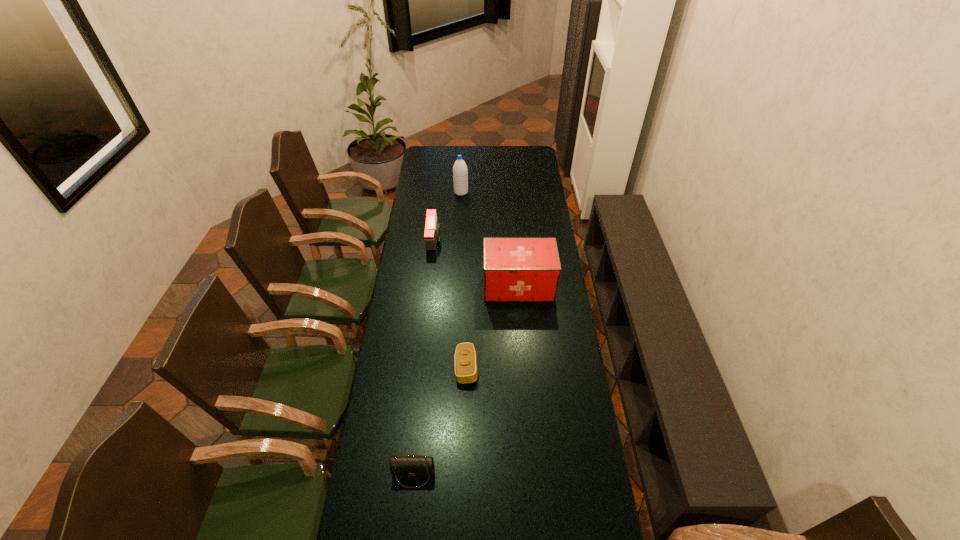
The width and height of the screenshot is (960, 540). Find the location of `free space located on the handle side of the rightmost object`. free space located on the handle side of the rightmost object is located at coordinates pos(426,286).

Find the location of a particular element. The height and width of the screenshot is (540, 960). vacant region located on the handle side of the rightmost object is located at coordinates (398, 286).

Locate an element on the screen. This screenshot has width=960, height=540. vacant space located on the handle side of the rightmost object is located at coordinates (417, 286).

Identify the location of blank space located 0.170m on the front-facing side of the third shortest object. The width and height of the screenshot is (960, 540). [x=475, y=240].

Where is `free region located 0.060m on the front flap of the nearer clutch bag`? The height and width of the screenshot is (540, 960). free region located 0.060m on the front flap of the nearer clutch bag is located at coordinates (410, 509).

Where is `vacant position located on the zipper side of the right clutch bag`? Image resolution: width=960 pixels, height=540 pixels. vacant position located on the zipper side of the right clutch bag is located at coordinates (534, 368).

At what (x,y) coordinates should I click in order to perform the action: click on camera that is at the left edge. Please return your answer as a coordinate pair (x, y). Looking at the image, I should click on (432, 228).

This screenshot has width=960, height=540. I want to click on clutch bag positioned at the left edge, so click(409, 466).

Where is `object positioned at the right edge`? This screenshot has width=960, height=540. object positioned at the right edge is located at coordinates click(515, 269).

The width and height of the screenshot is (960, 540). In the image, there is a desktop. Identify the location of free space at the far edge. (512, 150).